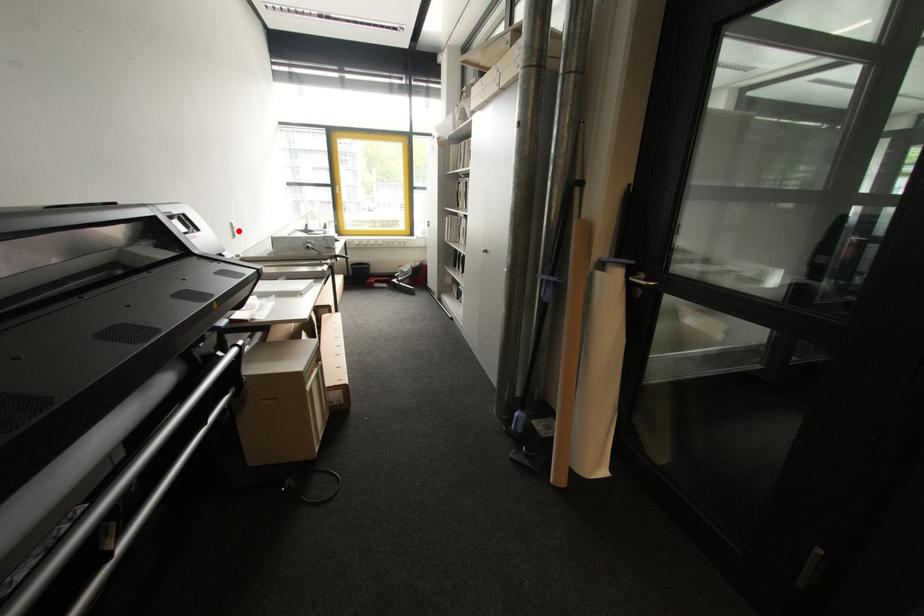
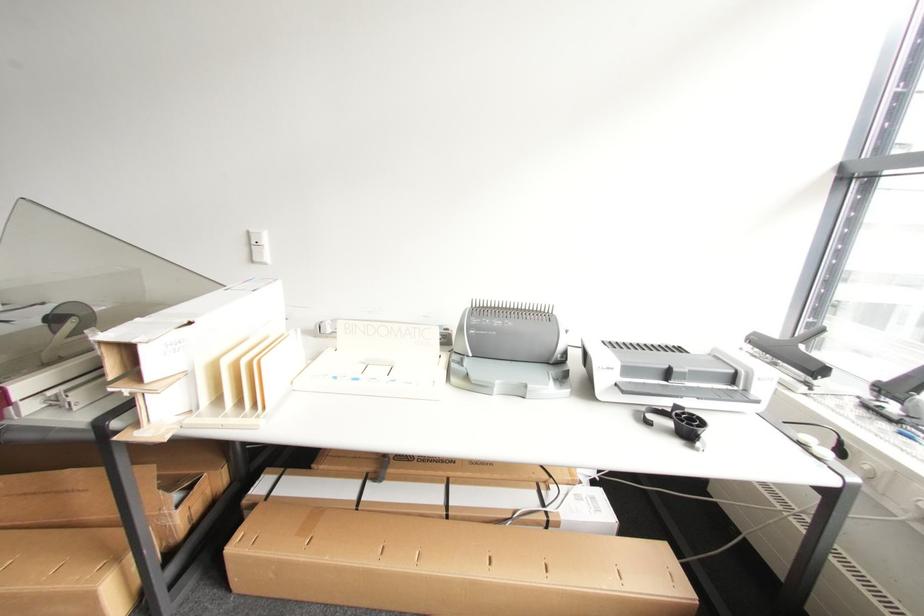
Where in the second image is the point corresponding to the highlighted location from the first image?

(257, 248)